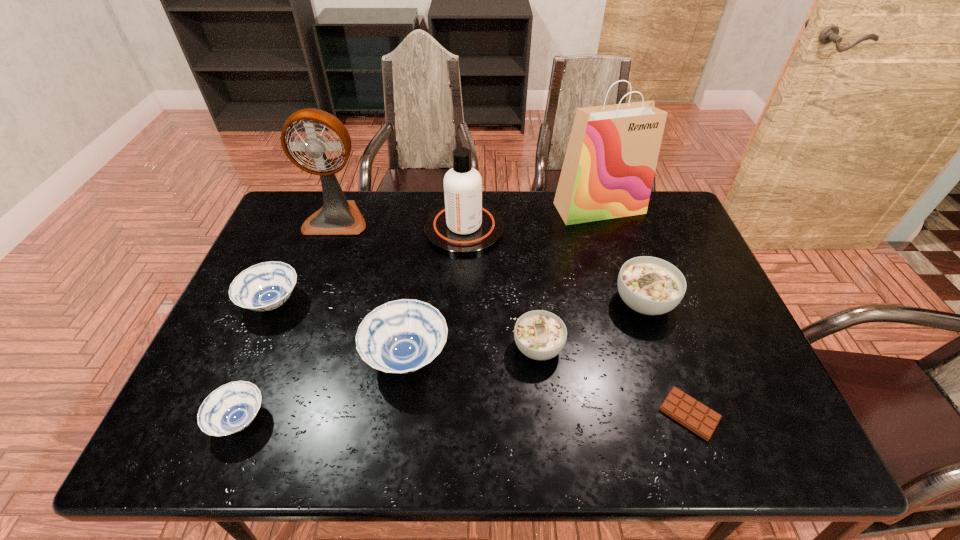
This screenshot has width=960, height=540. What are the coordinates of `vacant region located on the left of the smaller white soup bowl` in the screenshot? It's located at (437, 347).

At what (x,y) coordinates should I click in order to perform the action: click on vacant position located 0.210m on the back of the smallest blue soup bowl. Please return your answer as a coordinate pair (x, y). The image size is (960, 540). Looking at the image, I should click on (279, 321).

This screenshot has width=960, height=540. I want to click on free spot located 0.340m on the left of the candy bar, so tap(506, 414).

Where is `shopping bag situated at the far edge`? Image resolution: width=960 pixels, height=540 pixels. shopping bag situated at the far edge is located at coordinates (608, 171).

You are a GUI agent. You are given a task and a screenshot of the screen. Output one action in this format:
    pyautogui.click(x=<x>, y=<y>)
    Task: Click on the fan positioned at the far edge
    This screenshot has width=960, height=540.
    Given the screenshot: What is the action you would take?
    pyautogui.click(x=338, y=216)

Where is `cleansing agent that is positioned at the far edge`? The width and height of the screenshot is (960, 540). cleansing agent that is positioned at the far edge is located at coordinates (464, 226).

The height and width of the screenshot is (540, 960). Identify the location of soup bowl present at the near edge. (229, 409).

Find the location of a particular element. The image size is (960, 540). candy bar present at the near edge is located at coordinates (700, 419).

Where is `fan situated at the left edge`? This screenshot has width=960, height=540. fan situated at the left edge is located at coordinates (338, 216).

You are a GUI agent. You are given a task and a screenshot of the screen. Output one action in this format:
    pyautogui.click(x=<x>, y=<y>)
    Task: Click on the shopping bag located at the right edge
    The width and height of the screenshot is (960, 540).
    Given the screenshot: What is the action you would take?
    pyautogui.click(x=608, y=171)